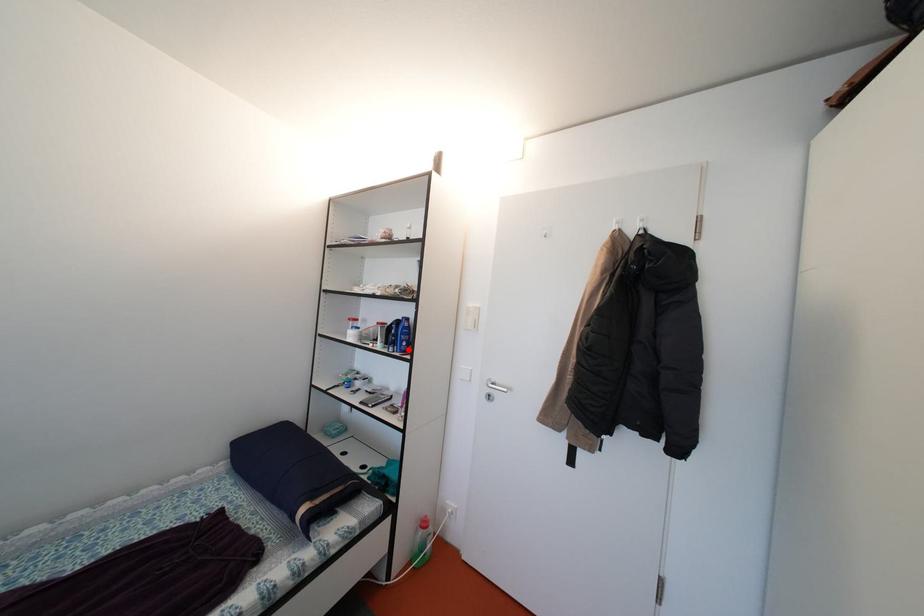
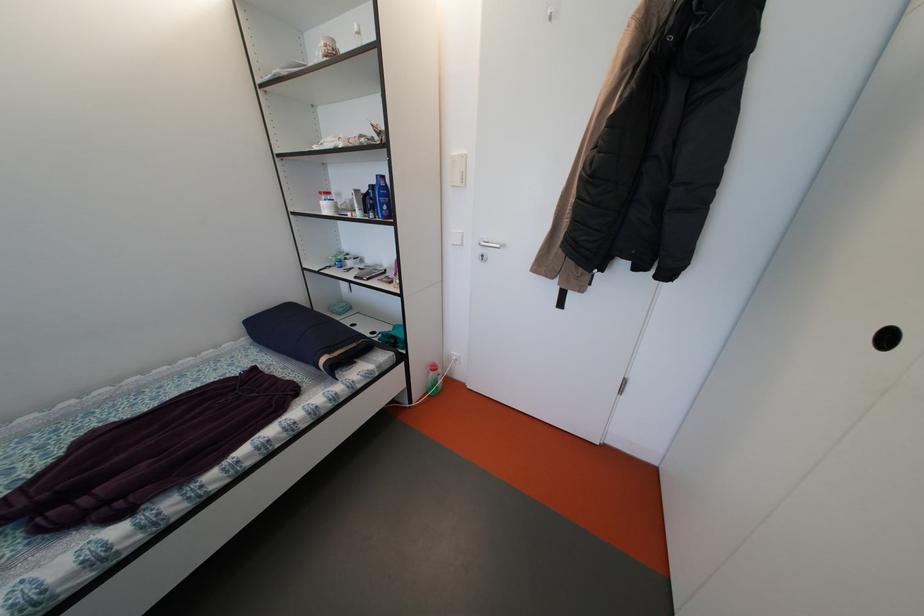
In the second image, find the point that corresponds to the highlighted location in the first image.

(390, 215)